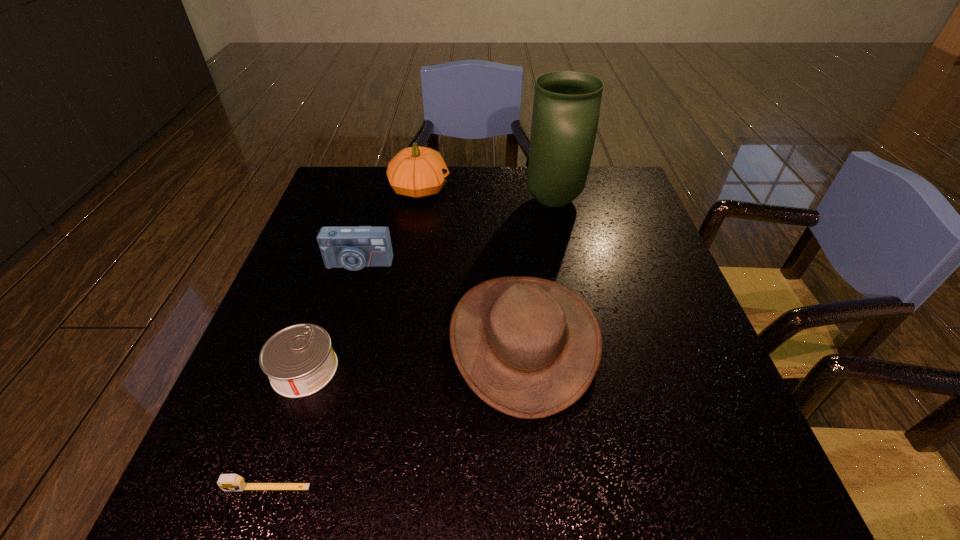
The height and width of the screenshot is (540, 960). Identify the location of free space located on the lens of the camera. (325, 374).

The width and height of the screenshot is (960, 540). I want to click on free space located on the back of the second shortest object, so click(343, 258).

Find the location of a particular element. The image size is (960, 540). vase that is at the far edge is located at coordinates (566, 108).

At what (x,y) coordinates should I click in order to perform the action: click on gourd that is at the far edge. Please return your answer as a coordinate pair (x, y). Image resolution: width=960 pixels, height=540 pixels. Looking at the image, I should click on point(417,172).

Locate an element on the screen. The image size is (960, 540). object located at the near edge is located at coordinates (227, 482).

You are a GUI agent. You are given a task and a screenshot of the screen. Output one action in this format:
    pyautogui.click(x=<x>, y=<y>)
    Task: Click on the camera that is at the left edge
    Image resolution: width=960 pixels, height=540 pixels.
    Given the screenshot: What is the action you would take?
    pyautogui.click(x=353, y=248)

The image size is (960, 540). In order to click on can that is at the left edge in this screenshot , I will do `click(299, 360)`.

Identify the location of tape measure that is at the left edge. Image resolution: width=960 pixels, height=540 pixels. (227, 482).

You are a GUI agent. You are given a task and a screenshot of the screen. Output one action in this format:
    pyautogui.click(x=<x>, y=<y>)
    Task: Click on the object at the near left corner
    
    Given the screenshot: What is the action you would take?
    tap(227, 482)

In the image, there is a desktop. What are the coordinates of `vacant space at the right edge` in the screenshot? It's located at (644, 297).